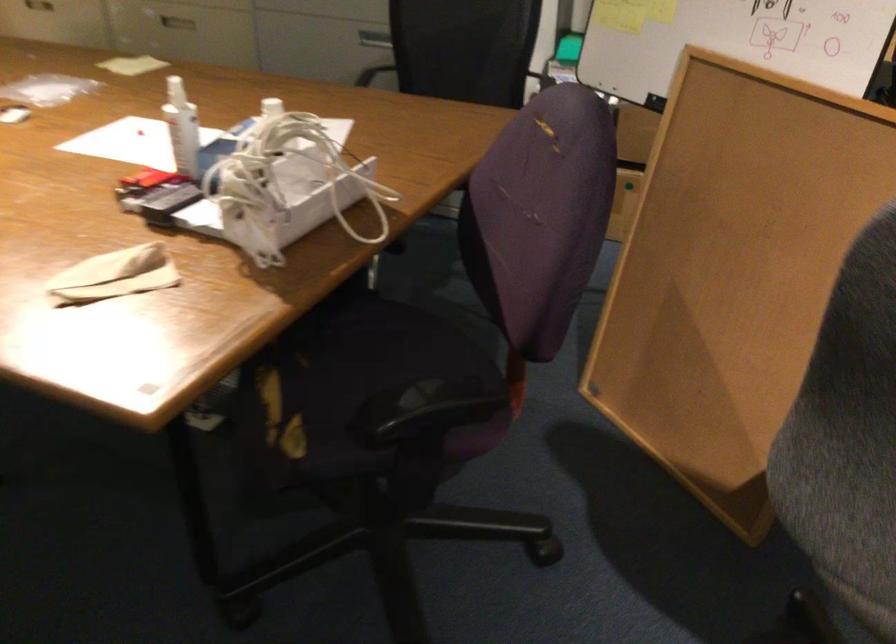
Where would you pull the cabinet drawer handle? Please return your answer as a coordinate pair (x, y).

(177, 19)